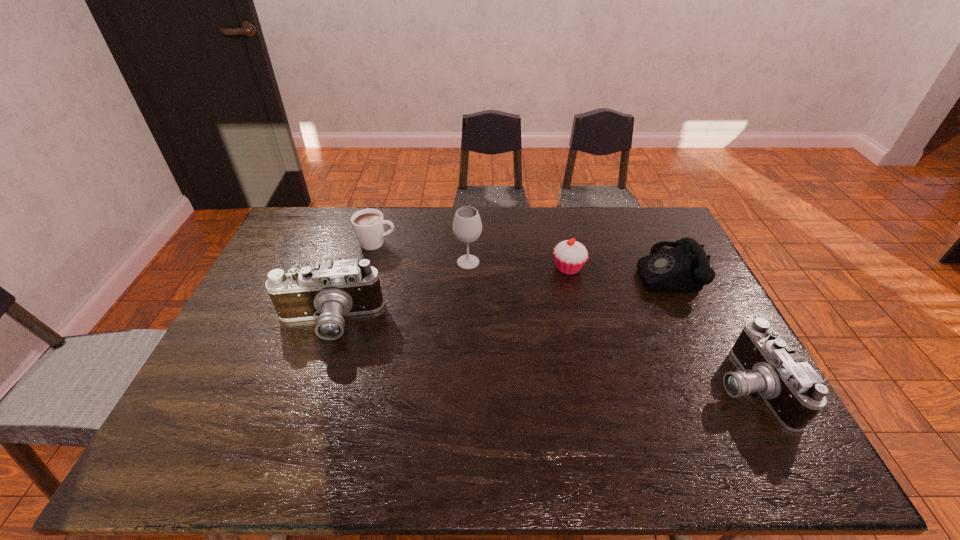
Where is `vacant region that satisfies the following two spatial constraints: 1. with the handle on the side of the cappuccino; 2. at the lens of the second tallest object`? vacant region that satisfies the following two spatial constraints: 1. with the handle on the side of the cappuccino; 2. at the lens of the second tallest object is located at coordinates (354, 322).

You are a GUI agent. You are given a task and a screenshot of the screen. Output one action in this format:
    pyautogui.click(x=<x>, y=<y>)
    Task: Click on the vacant area that satisfies the following two spatial constraints: 1. with the handle on the side of the cappuccino; 2. on the right side of the tallest object
    The height and width of the screenshot is (540, 960).
    Given the screenshot: What is the action you would take?
    pyautogui.click(x=372, y=262)

You are a GUI agent. You are given a task and a screenshot of the screen. Output one action in this format:
    pyautogui.click(x=<x>, y=<y>)
    Task: Click on the free spot that satisfies the following two spatial constraints: 1. on the back side of the third object from right to left; 2. with the handle on the side of the cappuccino
    
    Given the screenshot: What is the action you would take?
    pyautogui.click(x=563, y=243)